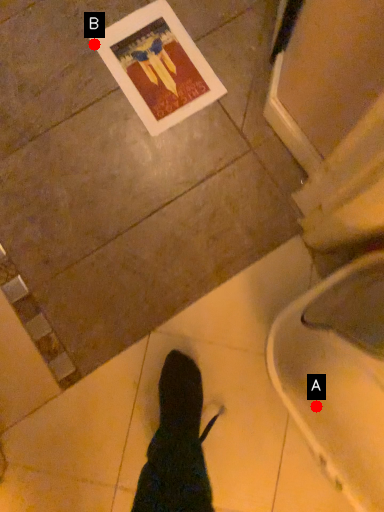
Question: Two points are circled on the image, labeled by A and B beside each circle. Which of the following is the closest to the observer?

Choices:
 (A) A is closer
 (B) B is closer

Answer: (A)